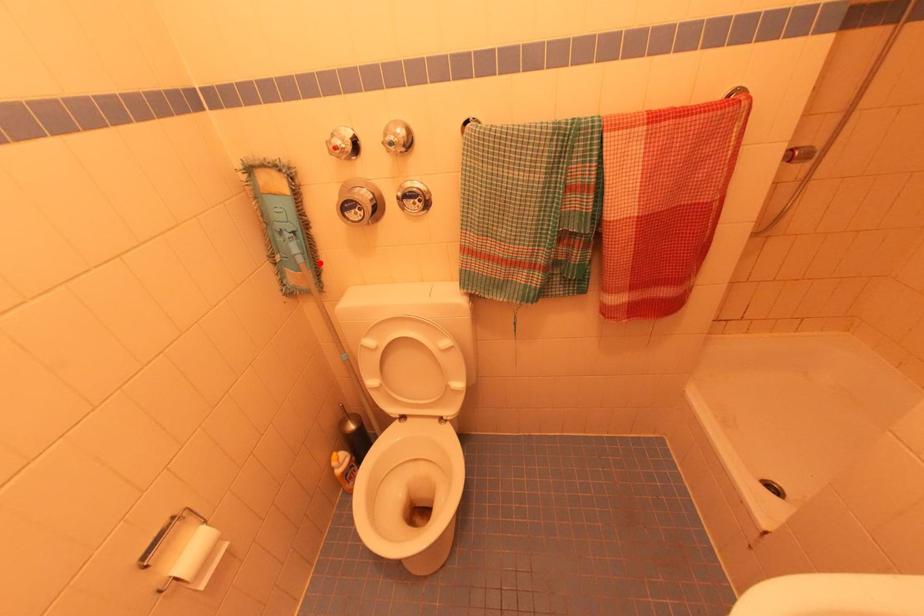
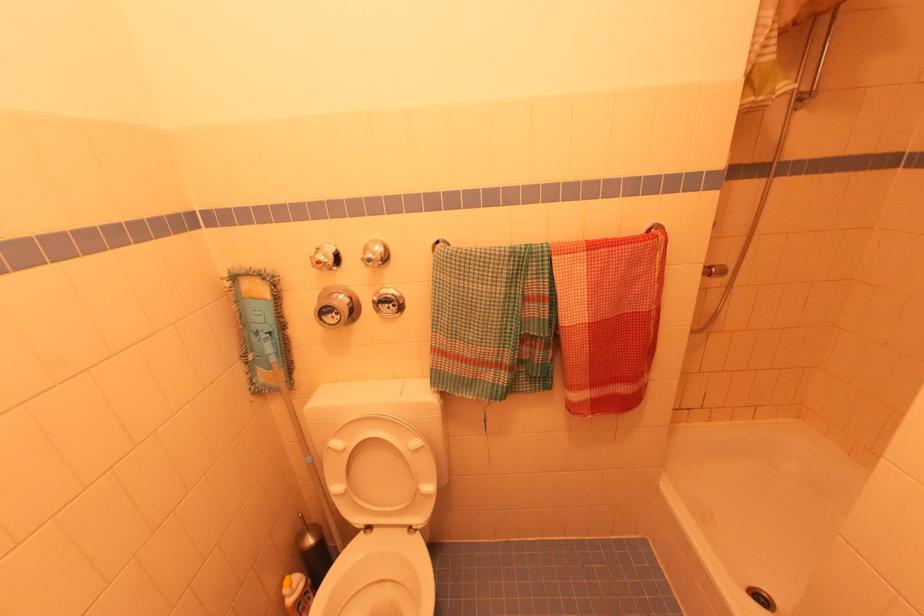
In the second image, find the point that corresponds to the highlighted location in the first image.

(293, 361)